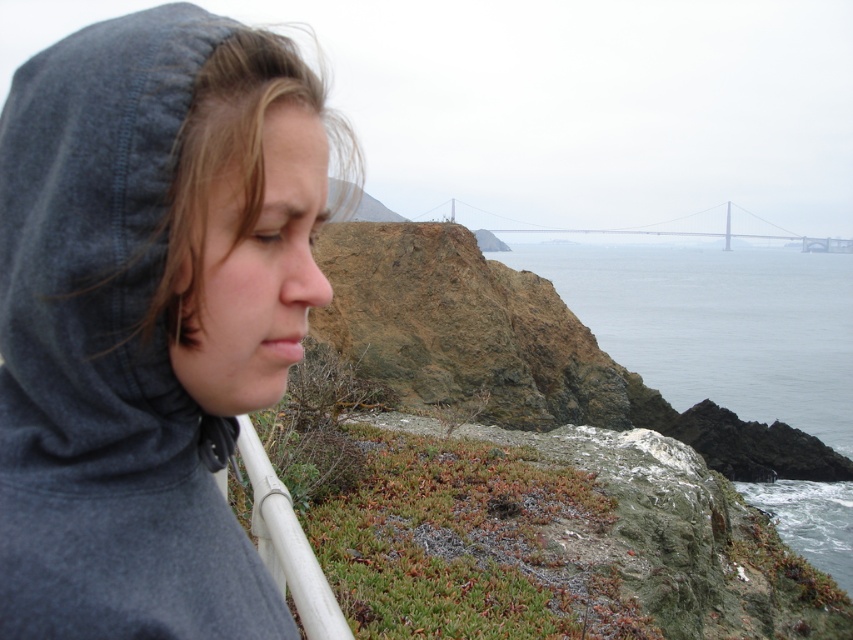
Question: Estimate the real-world distances between objects in this image. Which object is closer to the gray fleece hoodie at center?

Choices:
 (A) metallic gray suspension bridge at upper center
 (B) gray/rocky water at upper right
 (C) white plastic rail at lower center

Answer: (C)

Question: Estimate the real-world distances between objects in this image. Which object is closer to the metallic gray suspension bridge at upper center?

Choices:
 (A) gray fleece hoodie at center
 (B) gray/rocky water at upper right
 (C) white plastic rail at lower center

Answer: (B)

Question: Estimate the real-world distances between objects in this image. Which object is closer to the gray fleece hoodie at center?

Choices:
 (A) white plastic rail at lower center
 (B) metallic gray suspension bridge at upper center
 (C) gray/rocky water at upper right

Answer: (A)

Question: Does gray fleece hoodie at center have a smaller size compared to white plastic rail at lower center?

Choices:
 (A) yes
 (B) no

Answer: (A)

Question: Is gray fleece hoodie at center below metallic gray suspension bridge at upper center?

Choices:
 (A) no
 (B) yes

Answer: (B)

Question: Is gray fleece hoodie at center below metallic gray suspension bridge at upper center?

Choices:
 (A) no
 (B) yes

Answer: (B)